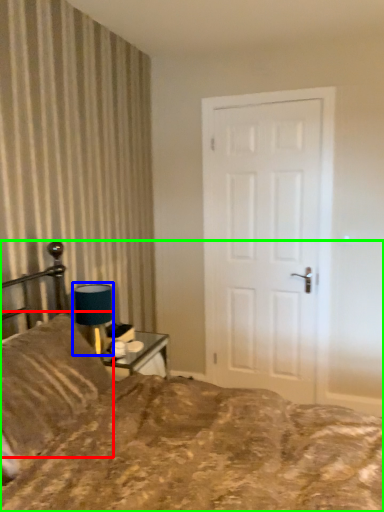
Question: Estimate the real-world distances between objects in this image. Which object is closer to pillow (highlighted by a red box), table lamp (highlighted by a blue box) or bed (highlighted by a green box)?

Choices:
 (A) table lamp
 (B) bed

Answer: (B)